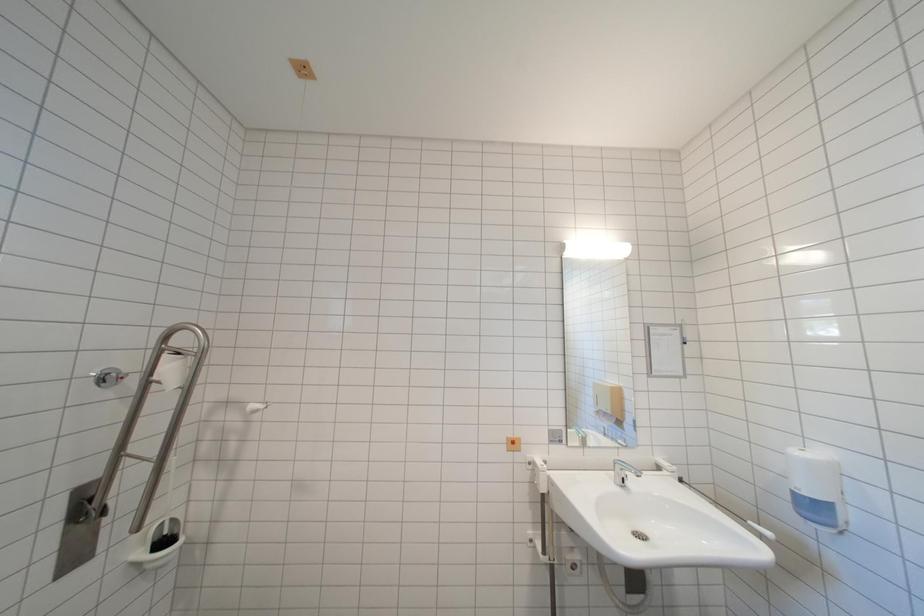
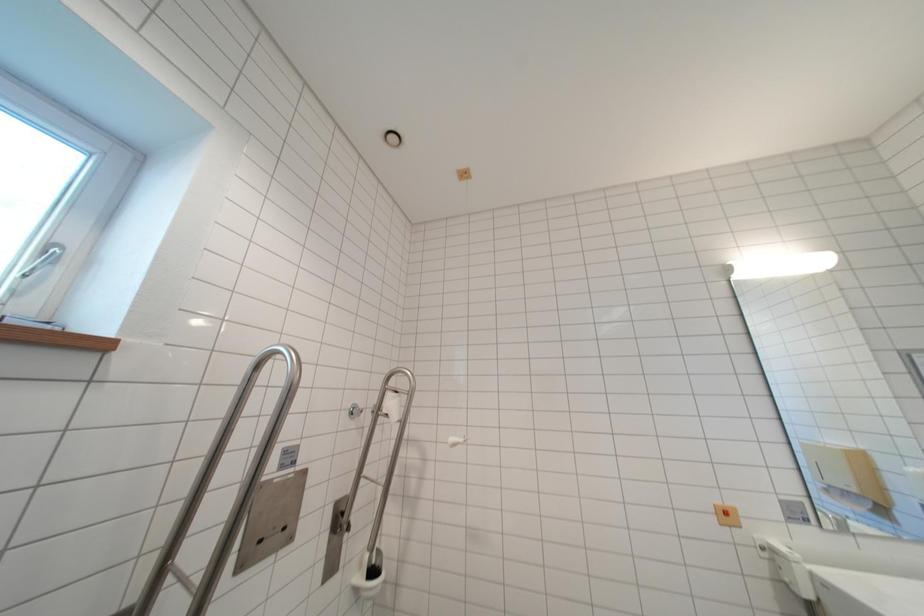
Question: The images are taken continuously from a first-person perspective. In which direction is your viewpoint rotating?

Choices:
 (A) Left
 (B) Right
 (C) Up
 (D) Down

Answer: (A)